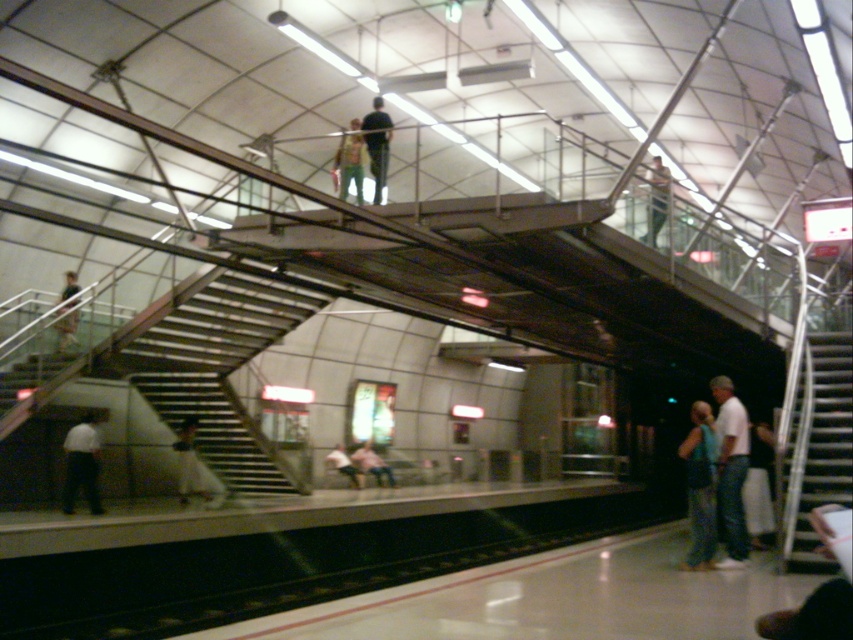
You are a commuter standing on the platform of the subway station. You notice a blue fabric bag at lower right and a white shirt at lower left. Which object is closer to the ground?

The blue fabric bag at lower right is closer to the ground since it is located below the white shirt at lower left.

You are a passenger waiting at the modern subway station. You see two fabrics, the pink fabric at center and the light pink fabric at lower center. Which one is wider?

The pink fabric at center is wider than the light pink fabric at lower center.